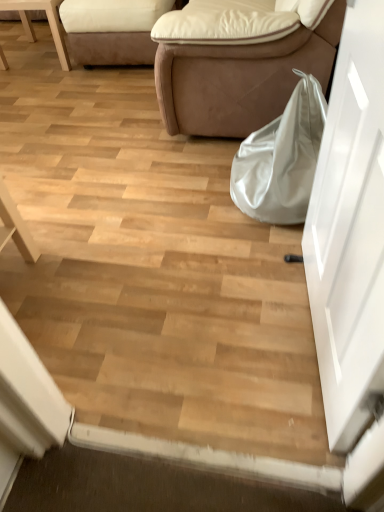
Locate an element on the screen. The image size is (384, 512). empty space that is in between brown leather couch at center, the 2th studio couch positioned from the left, and satin white bag at lower right is located at coordinates (203, 170).